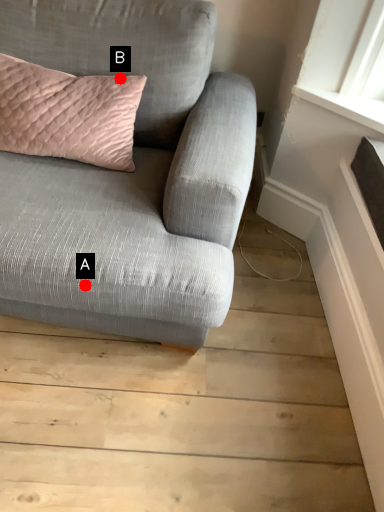
Question: Two points are circled on the image, labeled by A and B beside each circle. Among these points, which one is farthest from the camera?

Choices:
 (A) A is further
 (B) B is further

Answer: (B)